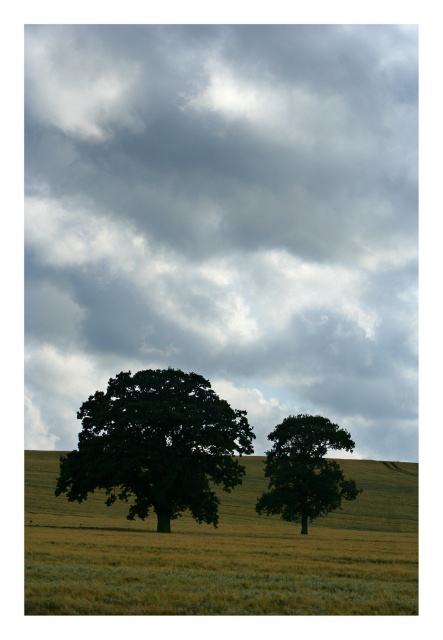
Between point (326, 305) and point (318, 499), which one is positioned in front?

Point (318, 499)

Can you confirm if cloudy gray sky at upper center is positioned below green leafy tree at center?

Incorrect, cloudy gray sky at upper center is not positioned below green leafy tree at center.

Does point (313, 122) come farther from viewer compared to point (292, 435)?

That is True.

The width and height of the screenshot is (443, 640). Find the location of `cloudy gray sky at upper center`. cloudy gray sky at upper center is located at coordinates [x=225, y=220].

In the scene shown: Does cloudy gray sky at upper center have a greater width compared to green leafy oak at center?

Indeed, cloudy gray sky at upper center has a greater width compared to green leafy oak at center.

Is cloudy gray sky at upper center above green leafy oak at center?

Indeed, cloudy gray sky at upper center is positioned over green leafy oak at center.

Locate an element on the screen. This screenshot has width=443, height=640. cloudy gray sky at upper center is located at coordinates (225, 220).

This screenshot has height=640, width=443. I want to click on cloudy gray sky at upper center, so click(x=225, y=220).

Which is behind, point (209, 502) or point (298, 518)?

The point (298, 518) is behind.

Based on the photo, can you confirm if green leafy oak at center is thinner than green leafy tree at center?

Incorrect, green leafy oak at center's width is not less than green leafy tree at center's.

Does point (186, 467) come behind point (334, 488)?

That is False.

Image resolution: width=443 pixels, height=640 pixels. What are the coordinates of `green leafy oak at center` in the screenshot? It's located at (156, 445).